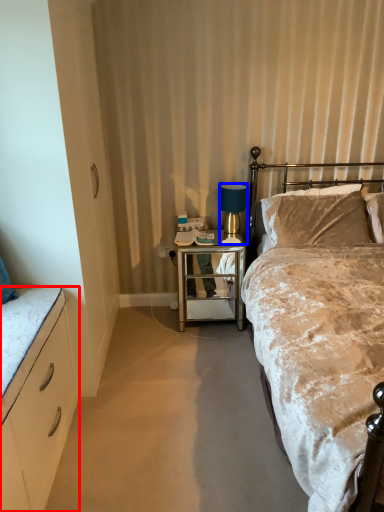
Question: Which object appears closest to the camera in this image, cabinetry (highlighted by a red box) or lamp (highlighted by a blue box)?

Choices:
 (A) cabinetry
 (B) lamp

Answer: (A)